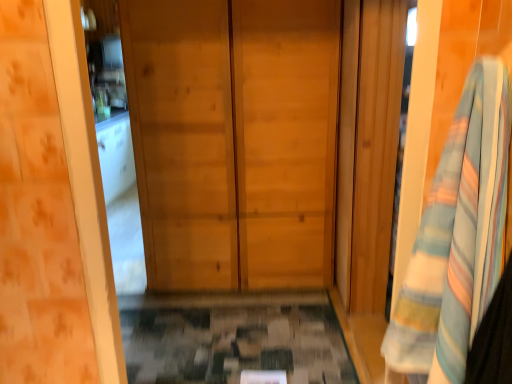
Question: From a real-world perspective, is natural wood door at center physically below striped cotton bath towel at right?

Choices:
 (A) yes
 (B) no

Answer: (A)

Question: Would you say natural wood door at center is a long distance from striped cotton bath towel at right?

Choices:
 (A) yes
 (B) no

Answer: (A)

Question: Considering the relative positions of natural wood door at center and striped cotton bath towel at right in the image provided, is natural wood door at center to the left of striped cotton bath towel at right from the viewer's perspective?

Choices:
 (A) no
 (B) yes

Answer: (B)

Question: Is natural wood door at center thinner than striped cotton bath towel at right?

Choices:
 (A) no
 (B) yes

Answer: (A)

Question: Is striped cotton bath towel at right completely or partially inside natural wood door at center?

Choices:
 (A) no
 (B) yes

Answer: (A)

Question: From the image's perspective, is natural wood door at center on top of striped cotton bath towel at right?

Choices:
 (A) no
 (B) yes

Answer: (B)

Question: Does striped cotton bath towel at right have a greater width compared to natural wood door at center?

Choices:
 (A) no
 (B) yes

Answer: (A)

Question: Is natural wood door at center surrounded by striped cotton bath towel at right?

Choices:
 (A) no
 (B) yes

Answer: (A)

Question: From a real-world perspective, is striped cotton bath towel at right under natural wood door at center?

Choices:
 (A) no
 (B) yes

Answer: (A)

Question: Considering the relative positions of striped cotton bath towel at right and natural wood door at center in the image provided, is striped cotton bath towel at right to the right of natural wood door at center from the viewer's perspective?

Choices:
 (A) yes
 (B) no

Answer: (A)

Question: From the image's perspective, is striped cotton bath towel at right on natural wood door at center?

Choices:
 (A) no
 (B) yes

Answer: (A)

Question: Is striped cotton bath towel at right facing away from natural wood door at center?

Choices:
 (A) no
 (B) yes

Answer: (A)

Question: In the image, is striped cotton bath towel at right on the left side or the right side of natural wood door at center?

Choices:
 (A) right
 (B) left

Answer: (A)